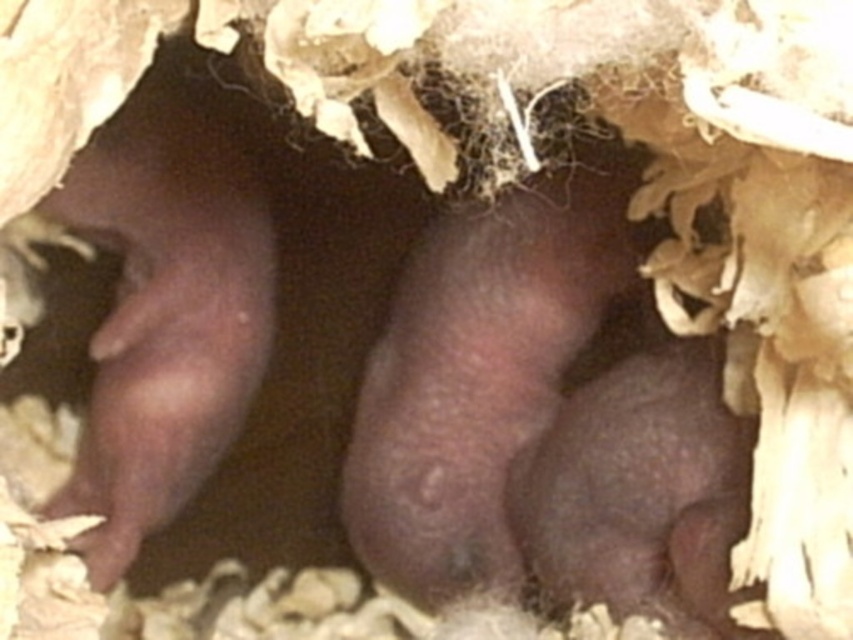
Which of these two, smooth dark brown hamster at left or fuzzy dark brown mouse at center, stands shorter?

fuzzy dark brown mouse at center

Is the position of smooth dark brown hamster at left less distant than that of fuzzy dark brown mouse at center?

No, smooth dark brown hamster at left is further to the viewer.

Describe the element at coordinates (165, 310) in the screenshot. The height and width of the screenshot is (640, 853). I see `smooth dark brown hamster at left` at that location.

At what (x,y) coordinates should I click in order to perform the action: click on smooth dark brown hamster at left. Please return your answer as a coordinate pair (x, y). The width and height of the screenshot is (853, 640). Looking at the image, I should click on (165, 310).

Between fuzzy dark brown hamster at center and smooth dark brown hamster at left, which one appears on the right side from the viewer's perspective?

fuzzy dark brown hamster at center

Who is more distant from viewer, (602,160) or (263,225)?

Point (263,225)

Where is `fuzzy dark brown hamster at center`? fuzzy dark brown hamster at center is located at coordinates (485, 369).

Does fuzzy dark brown hamster at center have a lesser width compared to fuzzy dark brown mouse at center?

No.

Does point (424, 310) come in front of point (593, 532)?

No, it is behind (593, 532).

Locate an element on the screen. fuzzy dark brown hamster at center is located at coordinates (485, 369).